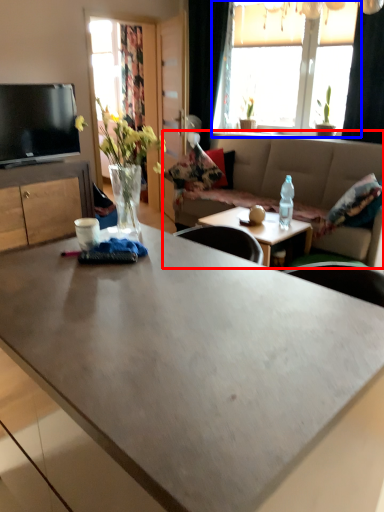
Question: Which object is closer to the camera taking this photo, studio couch (highlighted by a red box) or window (highlighted by a blue box)?

Choices:
 (A) studio couch
 (B) window

Answer: (A)